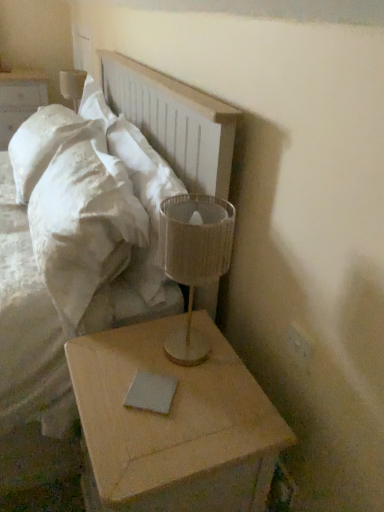
How much space does white matte nightstand at upper left, which ranks as the second nightstand in front-to-back order, occupy horizontally?

It is 18.95 inches.

At what (x,y) coordinates should I click in order to perform the action: click on white matte nightstand at upper left, which appears as the second nightstand when ordered from the bottom. Please return your answer as a coordinate pair (x, y). Looking at the image, I should click on (19, 100).

What do you see at coordinates (151, 392) in the screenshot? I see `gray matte notepad at lower center` at bounding box center [151, 392].

What do you see at coordinates (144, 201) in the screenshot? I see `white soft pillow at upper left` at bounding box center [144, 201].

This screenshot has height=512, width=384. What are the coordinates of `white matte nightstand at upper left, the 1th nightstand positioned from the left` in the screenshot? It's located at (19, 100).

Which is behind, light wood/roughnightstand at lower right, the 1th nightstand viewed from the front, or matte glass table lamp at upper left, which is the second table lamp in bottom-to-top order?

matte glass table lamp at upper left, which is the second table lamp in bottom-to-top order, is behind.

From the image's perspective, is light wood/roughnightstand at lower right, the 1th nightstand viewed from the front, located above matte glass table lamp at upper left, which is the second table lamp in bottom-to-top order?

No, from the image's perspective, light wood/roughnightstand at lower right, the 1th nightstand viewed from the front, is not on top of matte glass table lamp at upper left, which is the second table lamp in bottom-to-top order.

This screenshot has width=384, height=512. What are the coordinates of `nightstand located below the matte glass table lamp at upper left, placed as the first table lamp when sorted from left to right (from the image's perspective)` in the screenshot? It's located at (173, 425).

Considering the sizes of objects light wood/roughnightstand at lower right, the 1th nightstand viewed from the front, and white soft pillow at upper left in the image provided, who is smaller, light wood/roughnightstand at lower right, the 1th nightstand viewed from the front, or white soft pillow at upper left?

Smaller between the two is white soft pillow at upper left.

How different are the orientations of light wood/roughnightstand at lower right, the 1th nightstand from the right, and white soft pillow at upper left in degrees?

1.27 degrees separate the facing orientations of light wood/roughnightstand at lower right, the 1th nightstand from the right, and white soft pillow at upper left.

Based on the photo, are light wood/roughnightstand at lower right, which is the second nightstand from back to front, and white soft pillow at upper left making contact?

There is a gap between light wood/roughnightstand at lower right, which is the second nightstand from back to front, and white soft pillow at upper left.

Find the location of a particular element. The image size is (384, 512). nightstand that is in front of the white soft pillow at upper left is located at coordinates (173, 425).

From the picture: Considering the sizes of objects translucent fabric lampshade at right, which is counted as the 2th table lamp, starting from the back, and white fabric bed at upper left in the image provided, who is thinner, translucent fabric lampshade at right, which is counted as the 2th table lamp, starting from the back, or white fabric bed at upper left?

translucent fabric lampshade at right, which is counted as the 2th table lamp, starting from the back, is thinner.

Is translucent fabric lampshade at right, the second table lamp positioned from the left, spatially inside white fabric bed at upper left, or outside of it?

translucent fabric lampshade at right, the second table lamp positioned from the left, is located beyond the bounds of white fabric bed at upper left.

What's the angular difference between translucent fabric lampshade at right, arranged as the 1th table lamp when viewed from the right, and white fabric bed at upper left's facing directions?

They differ by 1.41 degrees in their facing directions.

Considering the points (32, 300) and (143, 177), which point is behind, point (32, 300) or point (143, 177)?

The point (143, 177) is more distant.

Relative to white soft pillow at upper left, is white fabric bed at upper left in front or behind?

Visually, white fabric bed at upper left is located in front of white soft pillow at upper left.

From a real-world perspective, is white fabric bed at upper left on white soft pillow at upper left?

Yes, from a real-world perspective, white fabric bed at upper left is above white soft pillow at upper left.

Is matte glass table lamp at upper left, which is the second table lamp in bottom-to-top order, oriented towards white soft pillow at upper left?

No, matte glass table lamp at upper left, which is the second table lamp in bottom-to-top order, is not aimed at white soft pillow at upper left.

Between matte glass table lamp at upper left, the second table lamp viewed from the front, and white soft pillow at upper left, which one has smaller size?

With smaller size is matte glass table lamp at upper left, the second table lamp viewed from the front.

Based on the photo, between white soft pillow at upper left and gray matte notepad at lower center, which one appears on the right side from the viewer's perspective?

Positioned to the right is gray matte notepad at lower center.

Can you tell me how much white soft pillow at upper left and gray matte notepad at lower center differ in facing direction?

white soft pillow at upper left and gray matte notepad at lower center are facing 33 degrees away from each other.

Would you say white soft pillow at upper left contains gray matte notepad at lower center?

Definitely not — gray matte notepad at lower center is not inside white soft pillow at upper left.

The width and height of the screenshot is (384, 512). I want to click on notepad below the white soft pillow at upper left (from the image's perspective), so point(151,392).

Consider the image. Considering the positions of objects white soft pillow at upper left and light wood/roughnightstand at lower right, which is the first nightstand from bottom to top, in the image provided, who is more to the right, white soft pillow at upper left or light wood/roughnightstand at lower right, which is the first nightstand from bottom to top,?

Positioned to the right is light wood/roughnightstand at lower right, which is the first nightstand from bottom to top.

Is white soft pillow at upper left positioned far away from light wood/roughnightstand at lower right, the 1th nightstand viewed from the front?

white soft pillow at upper left is actually quite close to light wood/roughnightstand at lower right, the 1th nightstand viewed from the front.

How far apart are white soft pillow at upper left and light wood/roughnightstand at lower right, which is the second nightstand from back to front?

17.54 inches.

Where is `nightstand located in front of the matte glass table lamp at upper left, the second table lamp viewed from the front`? This screenshot has height=512, width=384. nightstand located in front of the matte glass table lamp at upper left, the second table lamp viewed from the front is located at coordinates (173, 425).

Identify the location of the 2nd nightstand directly beneath the white soft pillow at upper left (from a real-world perspective). (173, 425).

Which object lies nearer to the anchor point white matte nightstand at upper left, the 1th nightstand positioned from the left, gray matte notepad at lower center or translucent fabric lampshade at right, positioned as the first table lamp in bottom-to-top order?

Based on the image, translucent fabric lampshade at right, positioned as the first table lamp in bottom-to-top order, appears to be nearer to white matte nightstand at upper left, the 1th nightstand positioned from the left.

When comparing their distances from matte glass table lamp at upper left, placed as the first table lamp when sorted from left to right, does white plastic electric outlet at upper right or gray matte notepad at lower center seem closer?

gray matte notepad at lower center.

When comparing their distances from white soft pillow at upper left, does light wood/roughnightstand at lower right, the second nightstand in the top-to-bottom sequence, or gray matte notepad at lower center seem closer?

Based on the image, light wood/roughnightstand at lower right, the second nightstand in the top-to-bottom sequence, appears to be nearer to white soft pillow at upper left.

Based on their spatial positions, is white soft pillow at upper left or gray matte notepad at lower center closer to white fabric bed at upper left?

Based on the image, white soft pillow at upper left appears to be nearer to white fabric bed at upper left.

Which object lies nearer to the anchor point white matte nightstand at upper left, which appears as the second nightstand when ordered from the bottom, matte glass table lamp at upper left, placed as the first table lamp when sorted from left to right, or white plastic electric outlet at upper right?

matte glass table lamp at upper left, placed as the first table lamp when sorted from left to right.

Estimate the real-world distances between objects in this image. Which object is closer to light wood/roughnightstand at lower right, arranged as the second nightstand when viewed from the left, white fabric bed at upper left or matte glass table lamp at upper left, the 1th table lamp in the back-to-front sequence?

The object closer to light wood/roughnightstand at lower right, arranged as the second nightstand when viewed from the left, is white fabric bed at upper left.

Considering their positions, is white fabric bed at upper left positioned closer to gray matte notepad at lower center than white plastic electric outlet at upper right?

Among the two, white plastic electric outlet at upper right is located nearer to gray matte notepad at lower center.

Based on their spatial positions, is translucent fabric lampshade at right, the second table lamp positioned from the left, or light wood/roughnightstand at lower right, the 1th nightstand from the right, further from white plastic electric outlet at upper right?

light wood/roughnightstand at lower right, the 1th nightstand from the right, is positioned further to the anchor white plastic electric outlet at upper right.

Find the location of a particular element. The image size is (384, 512). notepad between translucent fabric lampshade at right, the second table lamp positioned from the left, and white matte nightstand at upper left, which is counted as the first nightstand, starting from the top, in the front-back direction is located at coordinates (151, 392).

Identify the location of pillow located between white fabric bed at upper left and matte glass table lamp at upper left, which is the second table lamp in bottom-to-top order, in the depth direction. This screenshot has width=384, height=512. (144, 201).

Where is `table lamp between translucent fabric lampshade at right, arranged as the 1th table lamp when viewed from the right, and white matte nightstand at upper left, the second nightstand in the right-to-left sequence, in the front-back direction`? The width and height of the screenshot is (384, 512). table lamp between translucent fabric lampshade at right, arranged as the 1th table lamp when viewed from the right, and white matte nightstand at upper left, the second nightstand in the right-to-left sequence, in the front-back direction is located at coordinates (72, 86).

I want to click on pillow between white plastic electric outlet at upper right and matte glass table lamp at upper left, which is the second table lamp in right-to-left order, from front to back, so click(144, 201).